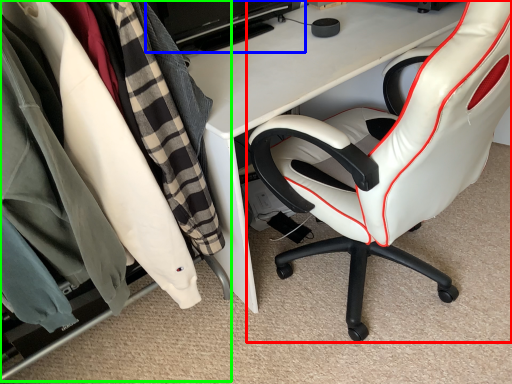
Question: Which object is positioned closest to chair (highlighted by a red box)? Select from computer monitor (highlighted by a blue box) and closet (highlighted by a green box).

Choices:
 (A) computer monitor
 (B) closet

Answer: (B)